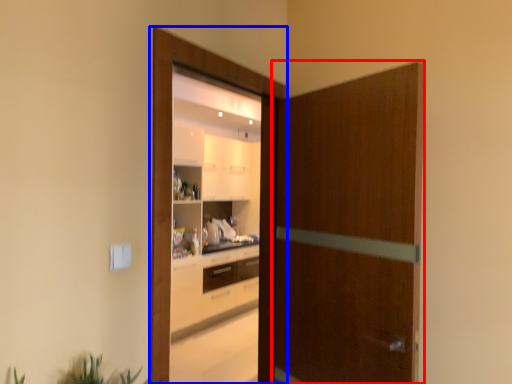
Question: Which of the following is the closest to the observer, screen door (highlighted by a red box) or screen door (highlighted by a blue box)?

Choices:
 (A) screen door
 (B) screen door

Answer: (A)